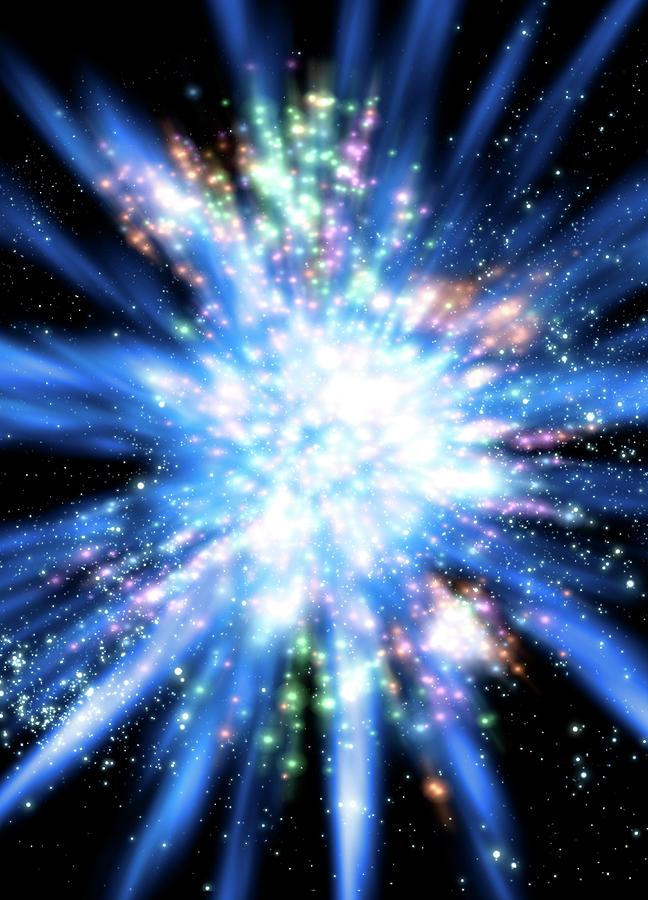
This screenshot has height=900, width=648. Find the location of `light purple light`. light purple light is located at coordinates (356, 153).